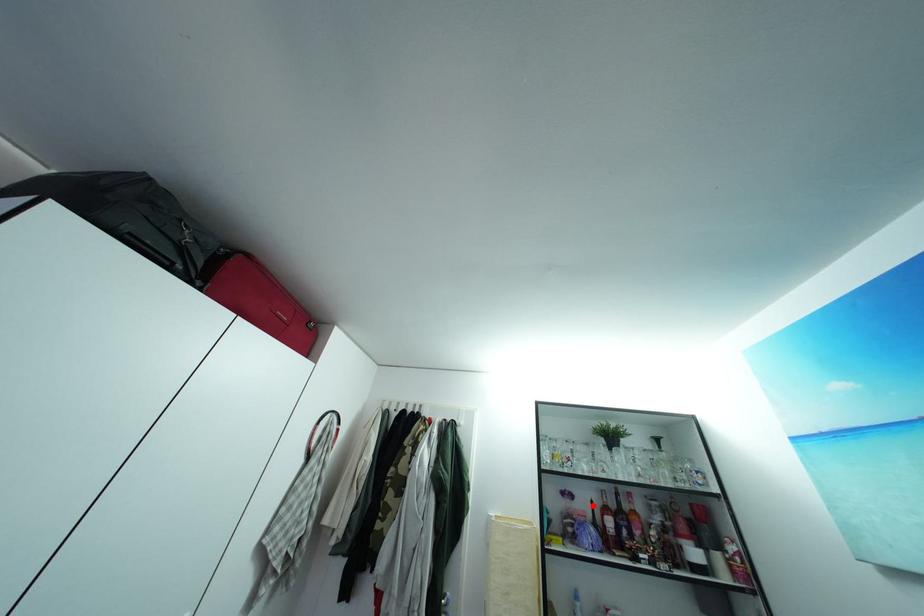
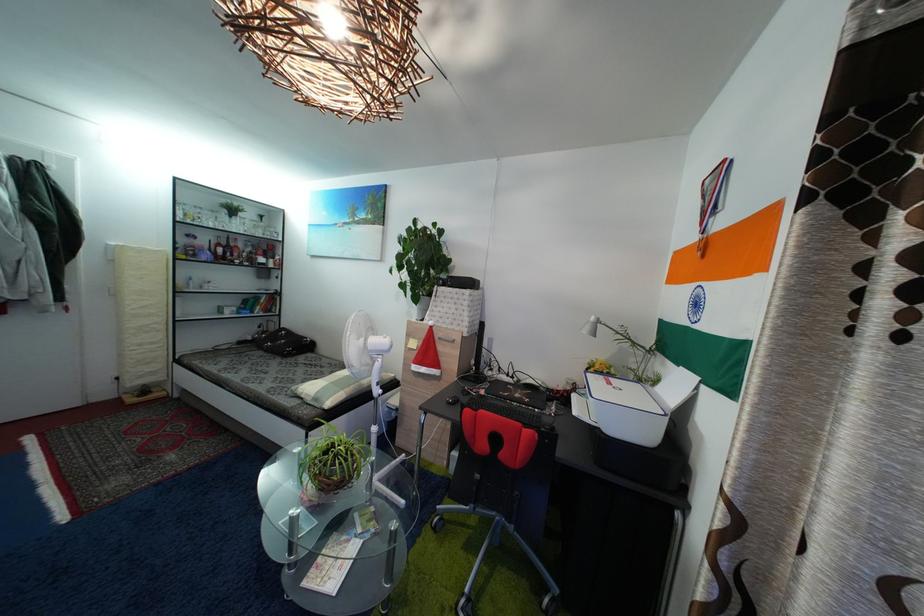
Question: I am providing you with two images of the same scene from different viewpoints. A red point is shown in image1. For the corresponding object point in image2, is it positioned nearer or farther from the camera?

Choices:
 (A) Nearer
 (B) Farther

Answer: (A)